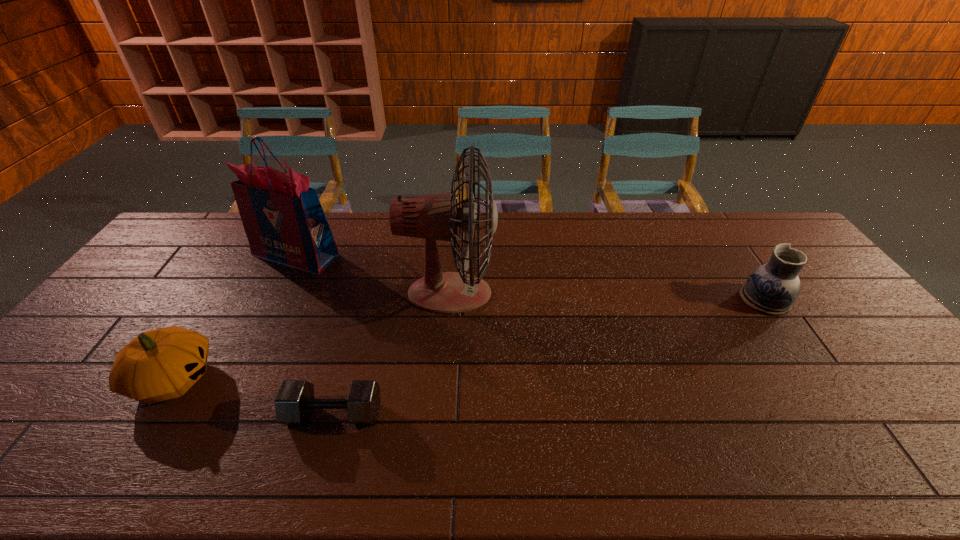
Find the location of `vacant space that satisfies the following two spatial constraints: 1. on the front-facing side of the grocery bag; 2. on the left side of the shortest object`. vacant space that satisfies the following two spatial constraints: 1. on the front-facing side of the grocery bag; 2. on the left side of the shortest object is located at coordinates (214, 414).

This screenshot has width=960, height=540. In order to click on free space that satisfies the following two spatial constraints: 1. in front of the fan to direct airflow; 2. on the left side of the pottery in this screenshot , I will do `click(449, 300)`.

Locate an element on the screen. The width and height of the screenshot is (960, 540). vacant region that satisfies the following two spatial constraints: 1. on the front-facing side of the pottery; 2. on the left side of the grocery bag is located at coordinates (273, 300).

Identify the location of free spot that satisfies the following two spatial constraints: 1. on the front-facing side of the third object from left to right; 2. on the left side of the grocery bag. (214, 414).

Where is `free location that satisfies the following two spatial constraints: 1. on the back side of the dumbbell; 2. on the left side of the pottery`? The width and height of the screenshot is (960, 540). free location that satisfies the following two spatial constraints: 1. on the back side of the dumbbell; 2. on the left side of the pottery is located at coordinates (367, 300).

This screenshot has height=540, width=960. What are the coordinates of `free space that satisfies the following two spatial constraints: 1. in front of the rightmost object to direct airflow; 2. on the left side of the fourth object from left to right` in the screenshot? It's located at (449, 300).

Identify the location of free location that satisfies the following two spatial constraints: 1. on the side of the dumbbell with the carved face; 2. on the left side of the gourd. This screenshot has width=960, height=540. (152, 414).

At what (x,y) coordinates should I click in order to perform the action: click on vacant space that satisfies the following two spatial constraints: 1. on the front-facing side of the grocery bag; 2. on the side of the gourd with the carved face. Please return your answer as a coordinate pair (x, y). Looking at the image, I should click on (231, 380).